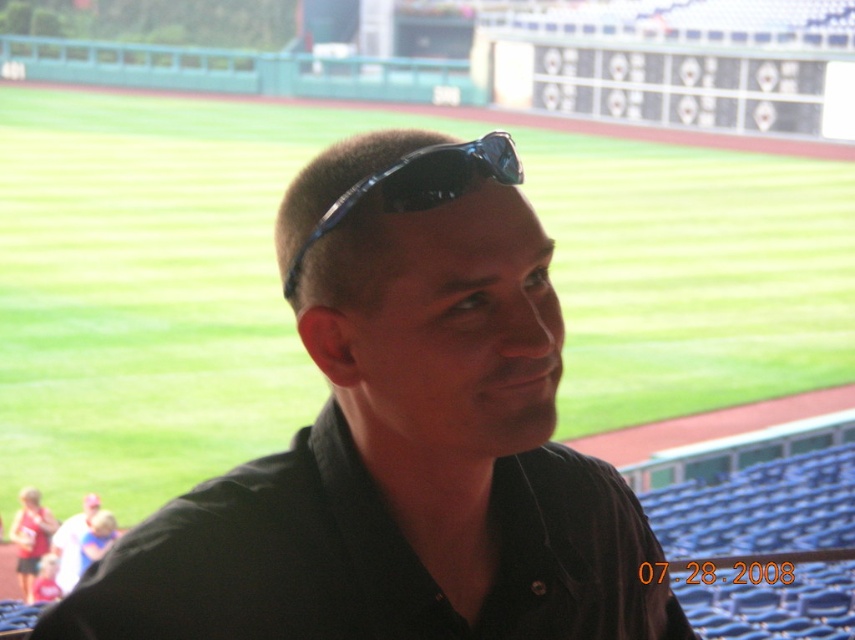
Question: Which of the following is the farthest from the observer?

Choices:
 (A) black plastic sunglasses at center
 (B) black matte sunglasses at center
 (C) black matte shirt at center

Answer: (C)

Question: Is black matte sunglasses at center bigger than black plastic sunglasses at center?

Choices:
 (A) yes
 (B) no

Answer: (A)

Question: Which point is closer to the camera?

Choices:
 (A) (464, 172)
 (B) (496, 440)

Answer: (A)

Question: Which point appears closest to the camera in this image?

Choices:
 (A) (211, 545)
 (B) (499, 301)

Answer: (B)

Question: Can you confirm if black matte shirt at center is positioned to the right of black plastic sunglasses at center?

Choices:
 (A) no
 (B) yes

Answer: (B)

Question: Does black matte shirt at center have a lesser width compared to black plastic sunglasses at center?

Choices:
 (A) yes
 (B) no

Answer: (B)